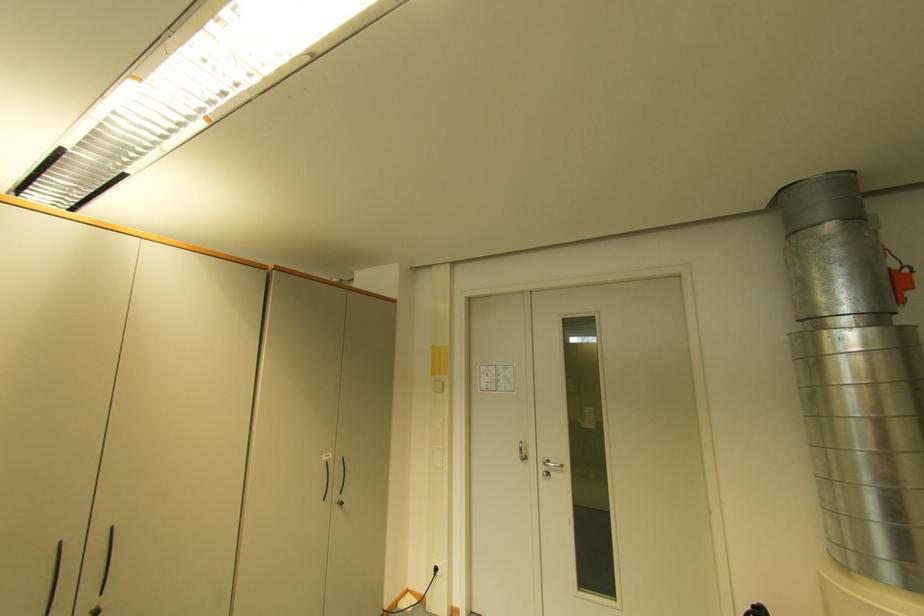
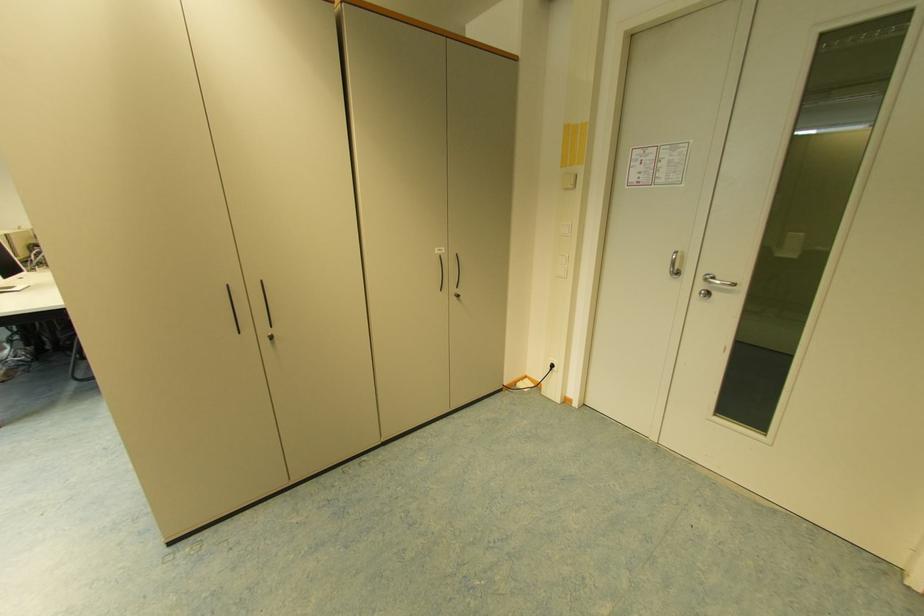
In the second image, find the point that corresponds to point (548, 464) in the first image.

(710, 280)